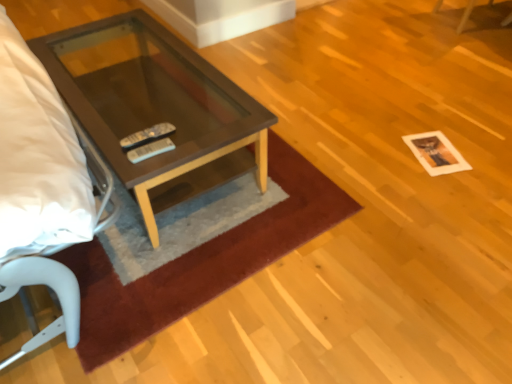
Question: Considering the positions of brown plush rug at center and matte brown glass coffee table at center in the image, is brown plush rug at center wider or thinner than matte brown glass coffee table at center?

Choices:
 (A) wide
 (B) thin

Answer: (A)

Question: In terms of height, does brown plush rug at center look taller or shorter compared to matte brown glass coffee table at center?

Choices:
 (A) tall
 (B) short

Answer: (B)

Question: Considering the real-world distances, which object is farthest from the white paper at lower right?

Choices:
 (A) matte brown glass coffee table at center
 (B) brown plush rug at center

Answer: (A)

Question: Based on their relative distances, which object is farther from the brown plush rug at center?

Choices:
 (A) white paper at lower right
 (B) matte brown glass coffee table at center

Answer: (A)